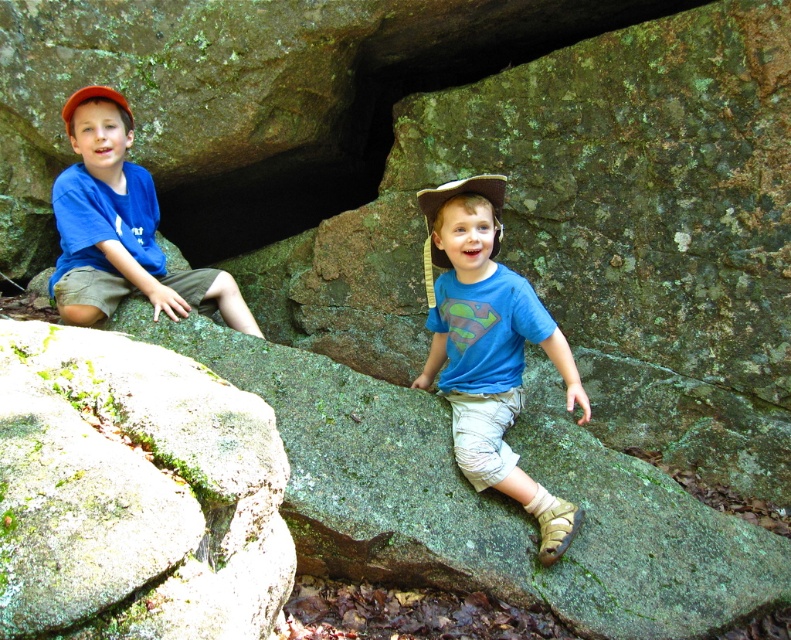
Question: Is green mossy rock at lower left to the left of matte blue shirt at left from the viewer's perspective?

Choices:
 (A) yes
 (B) no

Answer: (B)

Question: Can you confirm if blue cotton shirt at center is wider than brown leather baseball hat at center?

Choices:
 (A) yes
 (B) no

Answer: (A)

Question: Is blue cotton shirt at center to the right of matte blue shirt at left from the viewer's perspective?

Choices:
 (A) no
 (B) yes

Answer: (B)

Question: Which point appears closest to the camera in this image?

Choices:
 (A) (176, 586)
 (B) (182, 300)
 (C) (471, 182)

Answer: (A)

Question: Estimate the real-world distances between objects in this image. Which object is closer to the blue cotton shirt at center?

Choices:
 (A) green mossy rock at lower left
 (B) brown leather baseball hat at center
 (C) orange fabric baseball cap at left

Answer: (B)

Question: Which of the following is the closest to the observer?

Choices:
 (A) (133, 464)
 (B) (69, 115)

Answer: (A)